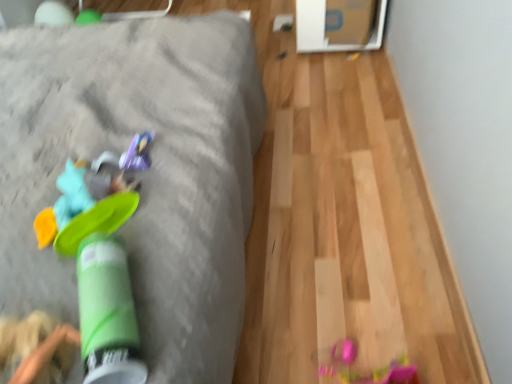
Question: Does green plastic cup at left appear on the left side of shiny purple toy at center, the first toy viewed from the back?

Choices:
 (A) no
 (B) yes

Answer: (B)

Question: Is green plastic cup at left oriented towards shiny purple toy at center, which appears as the second toy when viewed from the front?

Choices:
 (A) yes
 (B) no

Answer: (B)

Question: From a real-world perspective, is green plastic cup at left on top of shiny purple toy at center, the first toy viewed from the back?

Choices:
 (A) no
 (B) yes

Answer: (A)

Question: Can you confirm if green plastic cup at left is smaller than shiny purple toy at center, the first toy viewed from the back?

Choices:
 (A) yes
 (B) no

Answer: (B)

Question: Is green plastic cup at left looking in the opposite direction of shiny purple toy at center, the first toy viewed from the back?

Choices:
 (A) yes
 (B) no

Answer: (B)

Question: Is point (130, 160) closer or farther from the camera than point (120, 158)?

Choices:
 (A) farther
 (B) closer

Answer: (B)

Question: Relative to rubberized green frisbee at left, marked as the 2th toy in a back-to-front arrangement, is shiny purple toy at center, the first toy viewed from the back, in front or behind?

Choices:
 (A) front
 (B) behind

Answer: (B)

Question: Is shiny purple toy at center, the first toy viewed from the back, inside the boundaries of rubberized green frisbee at left, which ranks as the first toy in front-to-back order, or outside?

Choices:
 (A) outside
 (B) inside

Answer: (A)

Question: In terms of size, does shiny purple toy at center, the first toy viewed from the back, appear bigger or smaller than rubberized green frisbee at left, which ranks as the first toy in front-to-back order?

Choices:
 (A) small
 (B) big

Answer: (A)

Question: Does point (215, 14) appear closer or farther from the camera than point (138, 162)?

Choices:
 (A) farther
 (B) closer

Answer: (A)

Question: Looking at their shapes, would you say green plastic cup at left is wider or thinner than shiny purple toy at center, the first toy viewed from the back?

Choices:
 (A) thin
 (B) wide

Answer: (B)

Question: Considering the positions of green plastic cup at left and shiny purple toy at center, which appears as the second toy when viewed from the front, in the image, is green plastic cup at left bigger or smaller than shiny purple toy at center, which appears as the second toy when viewed from the front,?

Choices:
 (A) small
 (B) big

Answer: (B)

Question: Relative to shiny purple toy at center, the first toy viewed from the back, is green plastic cup at left in front or behind?

Choices:
 (A) behind
 (B) front

Answer: (A)

Question: In terms of width, does rubberized green frisbee at left, marked as the 2th toy in a back-to-front arrangement, look wider or thinner when compared to shiny purple toy at center, which appears as the second toy when viewed from the front?

Choices:
 (A) thin
 (B) wide

Answer: (B)

Question: Considering the positions of rubberized green frisbee at left, which ranks as the first toy in front-to-back order, and shiny purple toy at center, which appears as the second toy when viewed from the front, in the image, is rubberized green frisbee at left, which ranks as the first toy in front-to-back order, bigger or smaller than shiny purple toy at center, which appears as the second toy when viewed from the front,?

Choices:
 (A) small
 (B) big

Answer: (B)